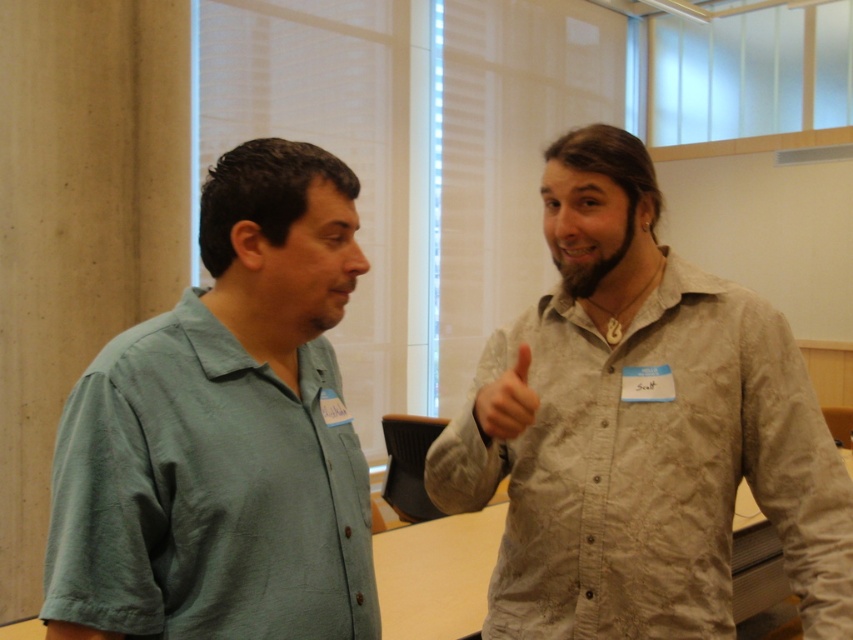
Is light brown textured shirt at upper right to the right of matte skin hand at upper right from the viewer's perspective?

Indeed, light brown textured shirt at upper right is positioned on the right side of matte skin hand at upper right.

Is light brown textured shirt at upper right smaller than matte skin hand at upper right?

Actually, light brown textured shirt at upper right might be larger than matte skin hand at upper right.

The width and height of the screenshot is (853, 640). I want to click on light brown textured shirt at upper right, so click(643, 429).

Who is higher up, green cotton shirt at left or matte skin hand at upper right?

green cotton shirt at left is higher up.

Which is more to the right, green cotton shirt at left or matte skin hand at upper right?

Positioned to the right is matte skin hand at upper right.

Which is in front, point (349, 179) or point (514, 424)?

Point (349, 179) is more forward.

The width and height of the screenshot is (853, 640). I want to click on green cotton shirt at left, so (224, 433).

Does point (682, 275) lie behind point (373, 620)?

Yes.

Does light brown textured shirt at upper right come behind green cotton shirt at left?

Yes.

Is point (558, 224) farther from camera compared to point (288, 394)?

Yes, point (558, 224) is behind point (288, 394).

Locate an element on the screen. light brown textured shirt at upper right is located at coordinates tap(643, 429).